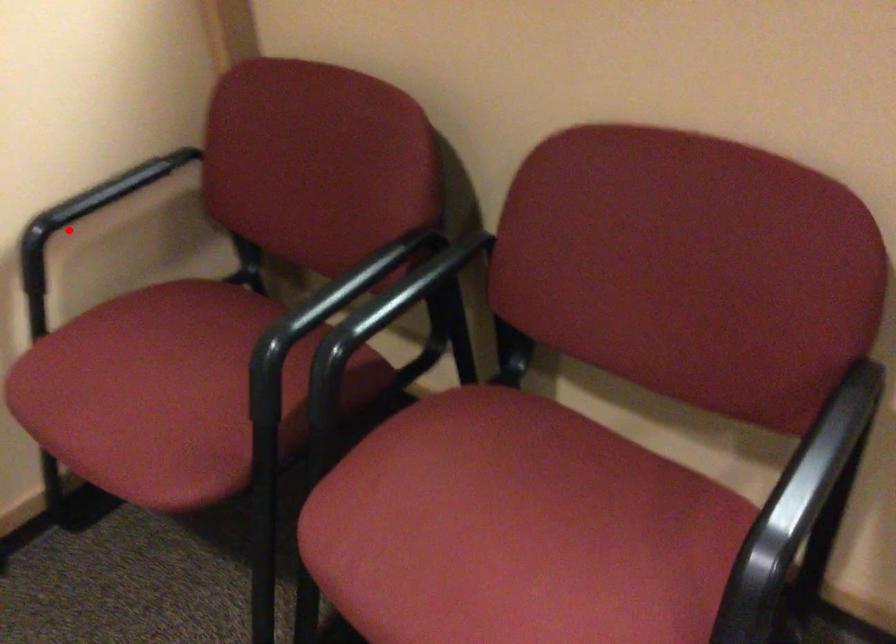
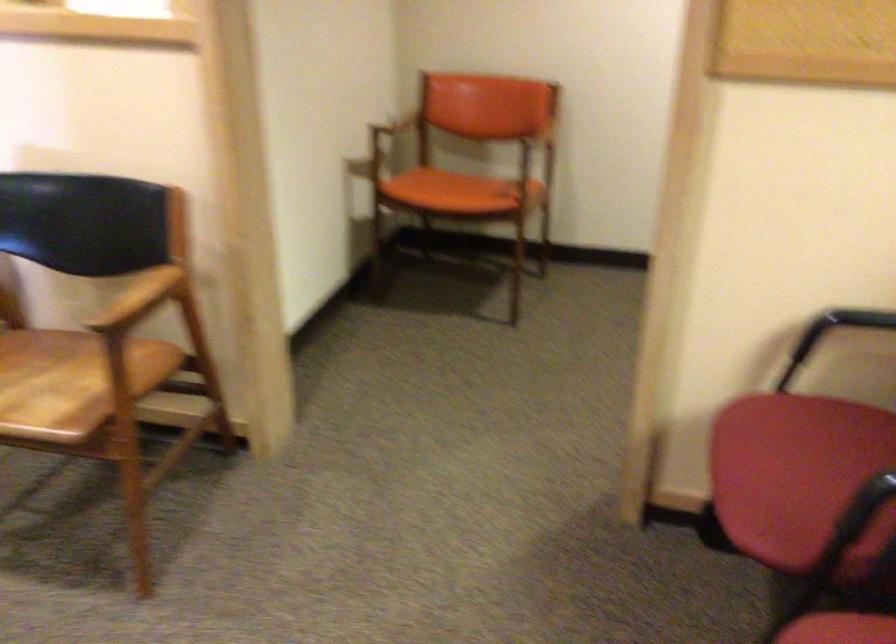
The point at the highlighted location is marked in the first image. Where is the corresponding point in the second image?

(840, 325)